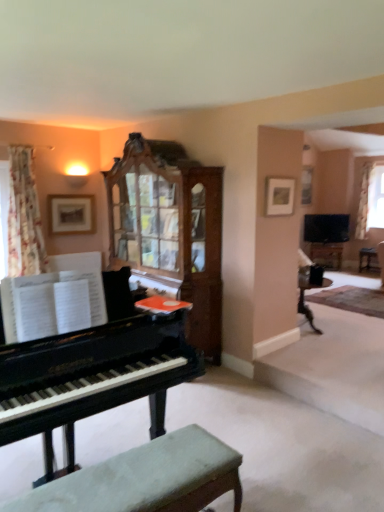
Question: Are white sheer curtain at upper right, the second curtain in the left-to-right sequence, and matte wooden picture frame at upper center, marked as the first picture frame in a front-to-back arrangement, located far from each other?

Choices:
 (A) no
 (B) yes

Answer: (B)

Question: Is white sheer curtain at upper right, which is the second curtain from front to back, directly adjacent to matte wooden picture frame at upper center, the 2th picture frame viewed from the left?

Choices:
 (A) yes
 (B) no

Answer: (B)

Question: Can you confirm if white sheer curtain at upper right, acting as the first curtain starting from the right, is positioned to the right of matte wooden picture frame at upper center, the 2th picture frame viewed from the left?

Choices:
 (A) yes
 (B) no

Answer: (A)

Question: Considering the relative sizes of white sheer curtain at upper right, which is the first curtain from back to front, and matte wooden picture frame at upper center, acting as the 1th picture frame starting from the right, in the image provided, is white sheer curtain at upper right, which is the first curtain from back to front, thinner than matte wooden picture frame at upper center, acting as the 1th picture frame starting from the right,?

Choices:
 (A) no
 (B) yes

Answer: (A)

Question: Does white sheer curtain at upper right, which is the first curtain from back to front, have a lesser height compared to matte wooden picture frame at upper center, marked as the first picture frame in a front-to-back arrangement?

Choices:
 (A) no
 (B) yes

Answer: (A)

Question: Is white sheer curtain at upper right, the second curtain in the left-to-right sequence, inside or outside of wooden picture frame at upper left, the first picture frame from the left?

Choices:
 (A) outside
 (B) inside

Answer: (A)

Question: Is point (364, 227) positioned closer to the camera than point (67, 206)?

Choices:
 (A) closer
 (B) farther

Answer: (B)

Question: In the image, is white sheer curtain at upper right, which is the second curtain from front to back, positioned in front of or behind wooden picture frame at upper left, marked as the 1th picture frame in a back-to-front arrangement?

Choices:
 (A) front
 (B) behind

Answer: (B)

Question: Considering the positions of white sheer curtain at upper right, the second curtain in the left-to-right sequence, and wooden picture frame at upper left, marked as the 1th picture frame in a back-to-front arrangement, in the image, is white sheer curtain at upper right, the second curtain in the left-to-right sequence, taller or shorter than wooden picture frame at upper left, marked as the 1th picture frame in a back-to-front arrangement,?

Choices:
 (A) short
 (B) tall

Answer: (B)

Question: Based on their positions, is matte black table at right located to the left or right of wooden side table at right?

Choices:
 (A) right
 (B) left

Answer: (B)

Question: Which is correct: matte black table at right is inside wooden side table at right, or outside of it?

Choices:
 (A) outside
 (B) inside

Answer: (A)

Question: Considering the positions of point (327, 252) and point (359, 261), is point (327, 252) closer or farther from the camera than point (359, 261)?

Choices:
 (A) closer
 (B) farther

Answer: (B)

Question: Is matte black table at right in front of or behind wooden side table at right in the image?

Choices:
 (A) behind
 (B) front

Answer: (A)

Question: Considering the positions of wooden side table at right and white sheer curtain at upper right, the second curtain in the left-to-right sequence, in the image, is wooden side table at right wider or thinner than white sheer curtain at upper right, the second curtain in the left-to-right sequence,?

Choices:
 (A) thin
 (B) wide

Answer: (B)

Question: Is wooden side table at right inside the boundaries of white sheer curtain at upper right, the second curtain in the left-to-right sequence, or outside?

Choices:
 (A) outside
 (B) inside

Answer: (A)